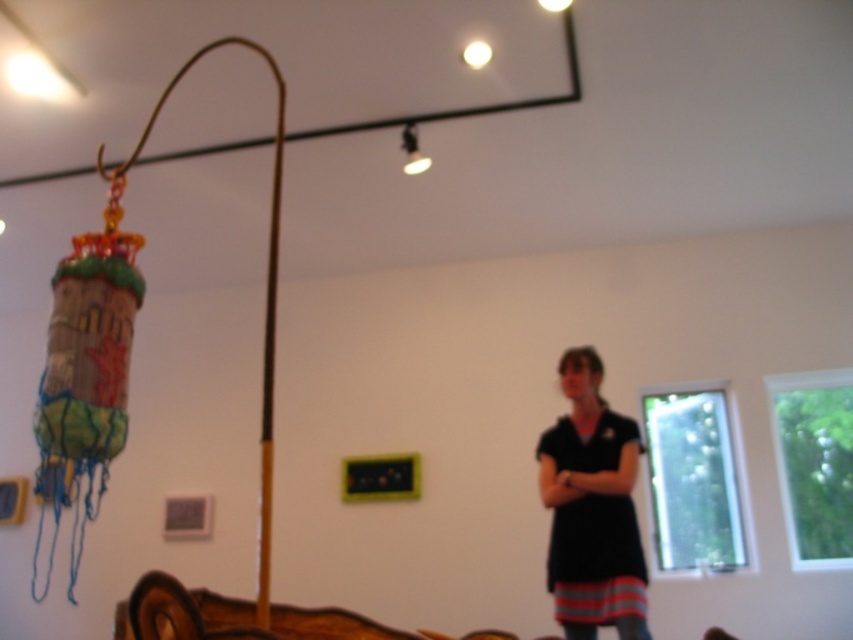
You are standing in the room and want to place a new painting on the wall near the black matte dress at right. Based on the dress location, where should the painting be positioned?

The black matte dress at right is located at point (592,508), so the painting should be placed near those coordinates on the wall.

You are trying to place a new rug in the room. The rug you have is exactly the same width as the matte black lamp at upper center. Can the rug fit entirely under the brown wooden bed at lower left without overlapping the edges?

The brown wooden bed at lower left has a width larger than the matte black lamp at upper center. Since the rug is the same width as the matte black lamp at upper center, it can fit entirely under the brown wooden bed at lower left as there is extra space on both sides.

Based on the photo, you are a fashion designer who wants to showcase a black matte dress at right. You need to place it near the brown wooden bed at lower left. Since the dress is taller than the bed, which object should be placed higher to ensure visibility?

The black matte dress at right should be placed higher since it is taller than the brown wooden bed at lower left, ensuring it remains visible.